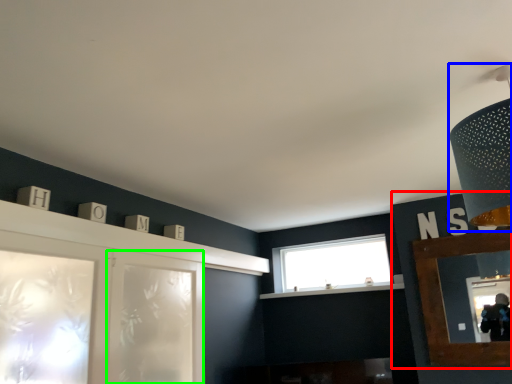
Question: Which object is positioned farthest from cabinetry (highlighted by a red box)? Select from light fixture (highlighted by a blue box) and screen door (highlighted by a green box).

Choices:
 (A) light fixture
 (B) screen door

Answer: (B)